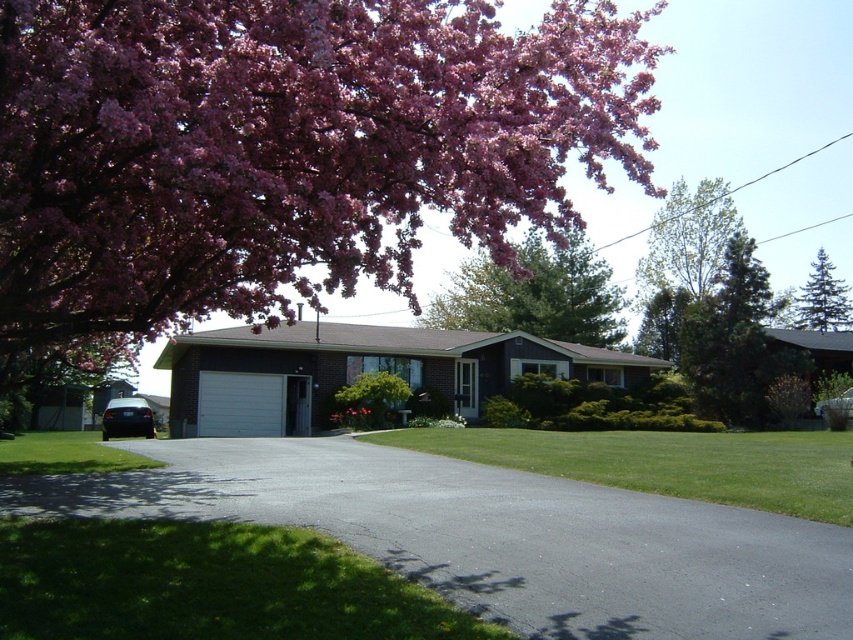
Question: Can you confirm if pink blossoming tree at center is wider than green leafy tree at upper right?

Choices:
 (A) yes
 (B) no

Answer: (A)

Question: Estimate the real-world distances between objects in this image. Which object is farther from the green textured pine tree at upper right?

Choices:
 (A) pink matte flower at center
 (B) pink bloom at upper left
 (C) black asphalt driveway at center
 (D) green leafy tree at upper right

Answer: (C)

Question: Does pink bloom at upper left appear on the left side of pink matte flower at center?

Choices:
 (A) no
 (B) yes

Answer: (A)

Question: Which object is positioned farthest from the black asphalt driveway at center?

Choices:
 (A) green leafy tree at upper right
 (B) pink bloom at upper left
 (C) pink matte flower at center
 (D) pink blossoming tree at center

Answer: (A)

Question: Does green leafy tree at upper right come in front of green textured pine tree at upper right?

Choices:
 (A) no
 (B) yes

Answer: (B)

Question: Which point is closer to the camera?

Choices:
 (A) (724, 188)
 (B) (662, 561)
 (C) (787, 360)

Answer: (B)